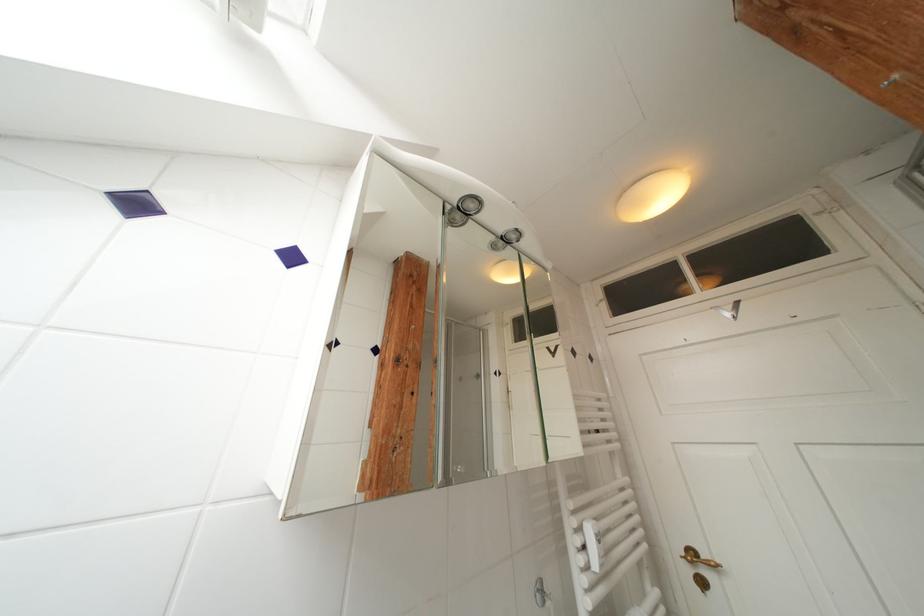
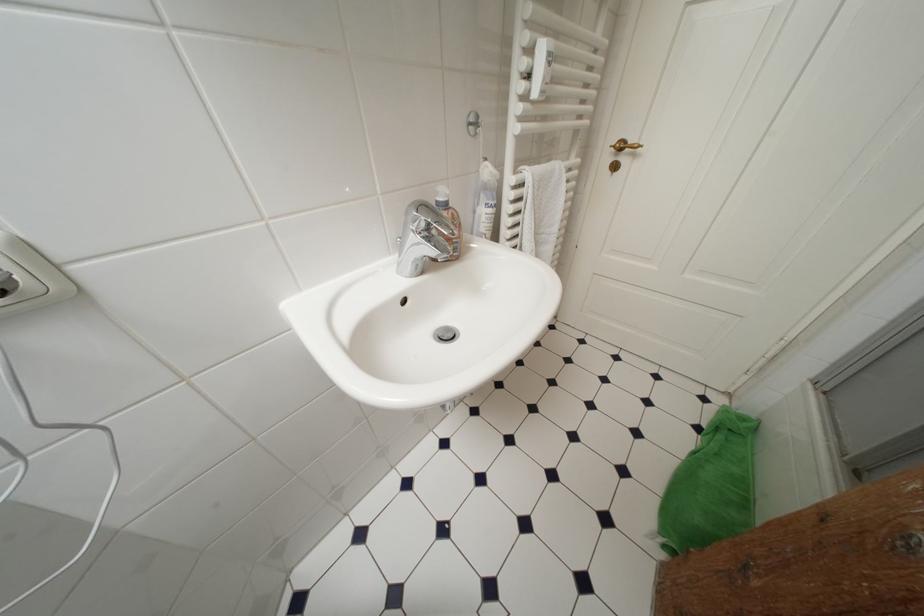
Question: The first image is from the beginning of the video and the second image is from the end. How did the camera likely rotate when shooting the video?

Choices:
 (A) Left
 (B) Right
 (C) Up
 (D) Down

Answer: (D)